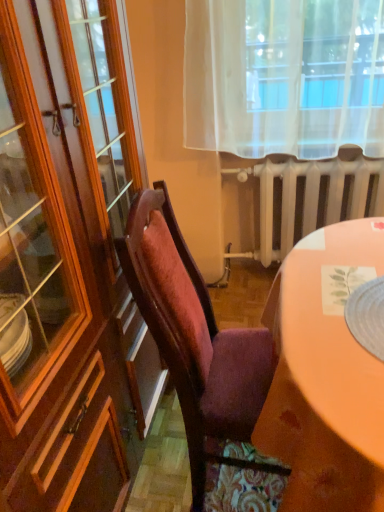
Question: Is point (210, 380) positioned closer to the camera than point (326, 194)?

Choices:
 (A) closer
 (B) farther

Answer: (A)

Question: From the image's perspective, is wooden chair at center positioned above or below white metallic radiator at center?

Choices:
 (A) above
 (B) below

Answer: (B)

Question: Is wooden chair at center situated inside white metallic radiator at center or outside?

Choices:
 (A) inside
 (B) outside

Answer: (B)

Question: Visually, is white metallic radiator at center positioned to the left or to the right of wooden chair at center?

Choices:
 (A) right
 (B) left

Answer: (A)

Question: Looking at the image, does white metallic radiator at center seem bigger or smaller compared to wooden chair at center?

Choices:
 (A) big
 (B) small

Answer: (B)

Question: From the image's perspective, is white metallic radiator at center positioned above or below wooden chair at center?

Choices:
 (A) below
 (B) above

Answer: (B)

Question: Is white metallic radiator at center in front of or behind wooden chair at center in the image?

Choices:
 (A) behind
 (B) front

Answer: (A)